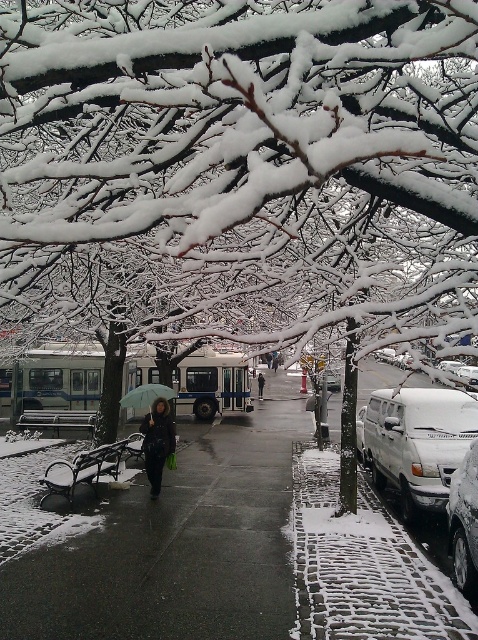
You are standing at the origin point of the image. Where is the shiny asphalt sidewalk at center located?

The shiny asphalt sidewalk at center is located at point (177, 547) from the origin point.

You are a delivery person with a cart that is 3 meters long. You need to move your cart between the white matte van at right and the white matte van at lower right. Can you fit your cart between them?

The white matte van at right and the white matte van at lower right are 3.78 meters apart, so yes, the cart can fit between them since the distance is greater than the cart length of 3 meters.

You are a delivery person trying to avoid stepping on the snow. You see the shiny asphalt sidewalk at center and the black matte coat at center. Which one is bigger and should you step on to stay on the clear path?

The shiny asphalt sidewalk at center is larger in size than the black matte coat at center, so stepping on the shiny asphalt sidewalk at center would be better to stay on the clear path.